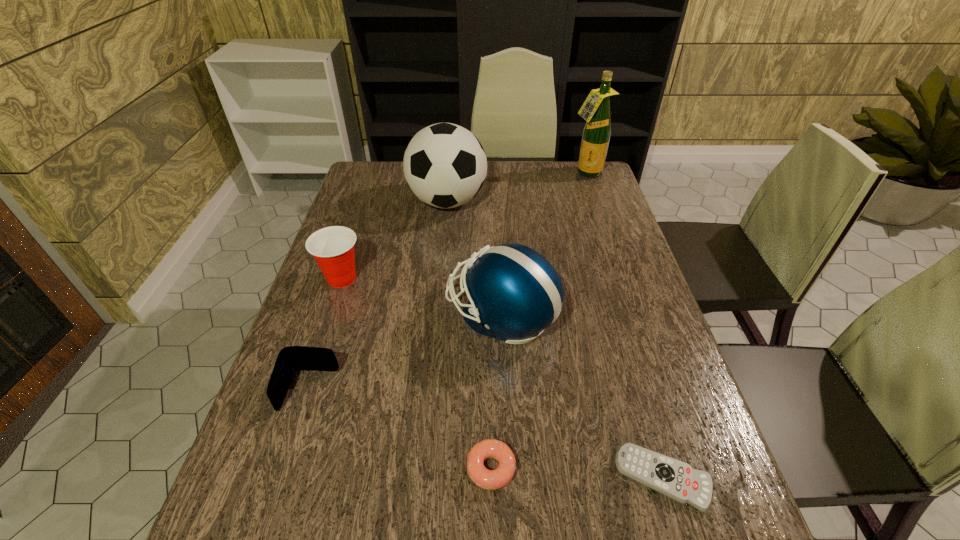
Find the location of `soccer ball present at the far edge`. soccer ball present at the far edge is located at coordinates (445, 166).

Locate an element on the screen. The height and width of the screenshot is (540, 960). cup located at the left edge is located at coordinates (332, 247).

Find the location of a particular element. Image resolution: width=960 pixels, height=540 pixels. wallet at the left edge is located at coordinates (292, 358).

Where is `liquor present at the right edge`? The image size is (960, 540). liquor present at the right edge is located at coordinates (596, 109).

This screenshot has height=540, width=960. Find the location of `remote control located in the right edge section of the desktop`. remote control located in the right edge section of the desktop is located at coordinates click(x=675, y=479).

Locate an element on the screen. This screenshot has width=960, height=540. object located in the far right corner section of the desktop is located at coordinates (596, 109).

You are a GUI agent. You are given a task and a screenshot of the screen. Output one action in this format:
    pyautogui.click(x=<x>, y=<y>)
    Task: Click on the free region at the far edge of the desktop
    The image size is (960, 540).
    Given the screenshot: What is the action you would take?
    pyautogui.click(x=542, y=180)

Identify the location of blank space at the left edge. (295, 392).

Where is `free point at the right edge`? Image resolution: width=960 pixels, height=540 pixels. free point at the right edge is located at coordinates (595, 310).

Locate an element on the screen. The height and width of the screenshot is (540, 960). vacant space at the far left corner of the desktop is located at coordinates (382, 178).